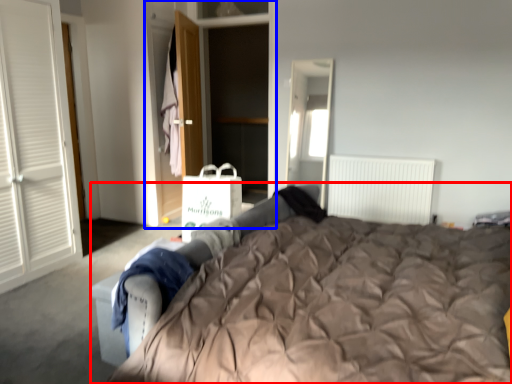
Question: Which object is further to the camera taking this photo, bed (highlighted by a red box) or armoire (highlighted by a blue box)?

Choices:
 (A) bed
 (B) armoire

Answer: (B)